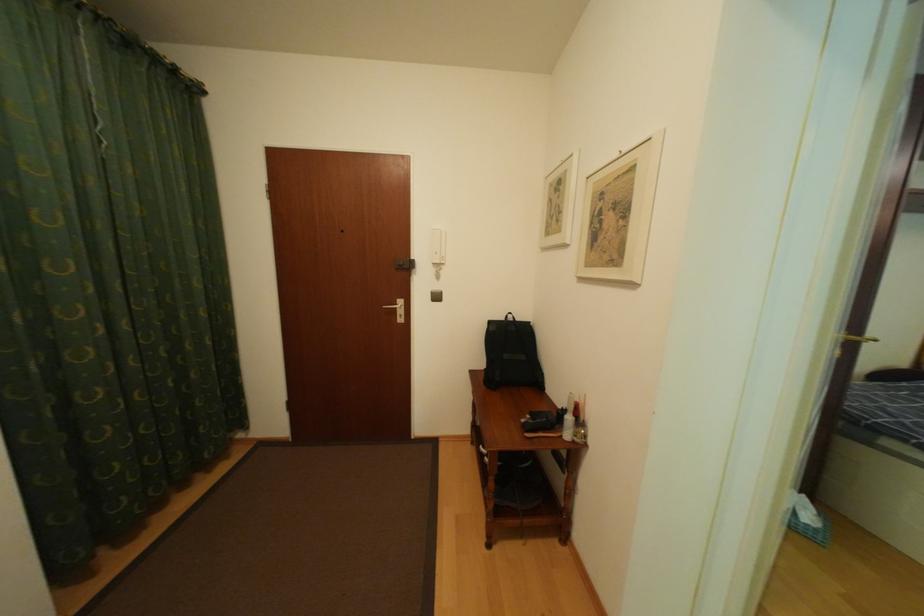
Locate an element on the screen. Image resolution: width=924 pixels, height=616 pixels. door lock knob is located at coordinates 405,264.